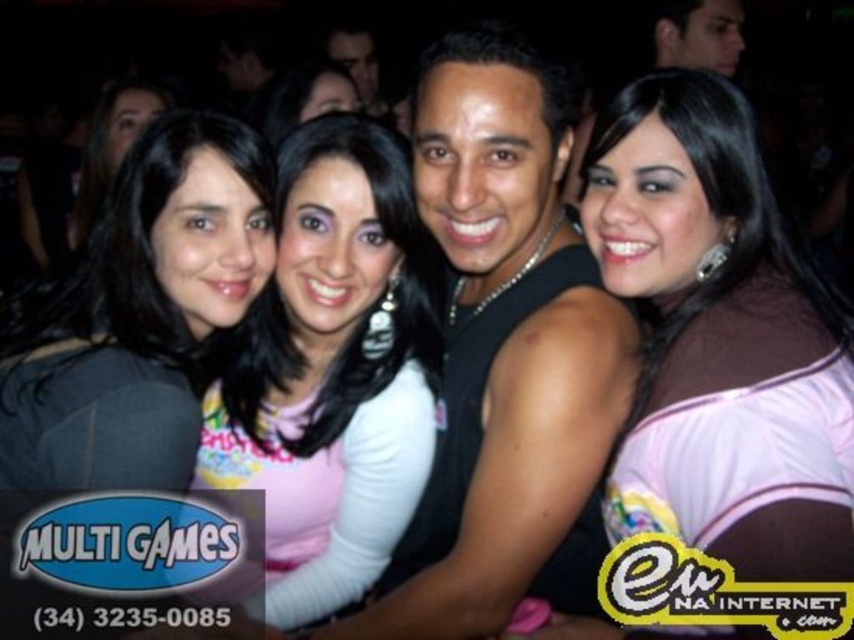
You are a photographer at the party and want to adjust your camera focus to capture both the matte black shirt at left and the matte black hair at center. Which object should you focus on first to ensure proper depth of field?

The matte black shirt at left is located below matte black hair at center, so you should focus on the matte black shirt at left first to ensure proper depth of field.

You are a photographer at a party and want to capture a photo of both the pink sheer top at center and the matte black shirt at left. Which of these two items is located lower in the frame?

The pink sheer top at center is positioned under the matte black shirt at left, so it is located lower in the frame.

You are standing at the camera position and want to take a photo of the point at coordinates point [831,292]. Is the point within the camera frame?

The point [831,292] is 4.68 feet away from the camera, so it is within the camera frame.